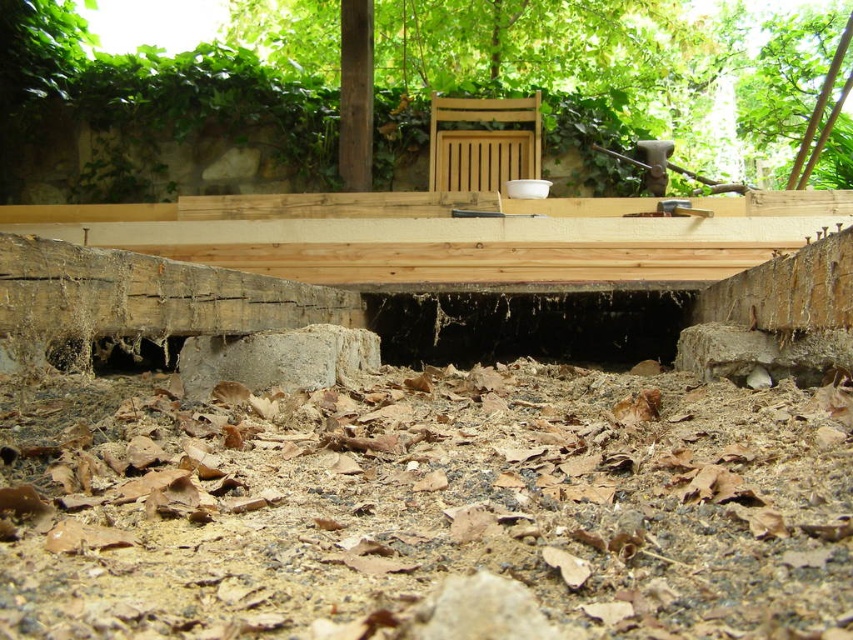
You are a contractor assessing the construction site. You need to determine if the brown dirt at center is level with the natural wood deck at center. Based on the scene, what can you conclude?

The brown dirt at center is shorter than the natural wood deck at center, so they are not level.

You are a construction worker who needs to move a 5 foot long tool from the brown dirt at center to the natural wood deck at center. Can you move the tool without bending or lifting it too high?

The brown dirt at center is 4.94 feet away from the natural wood deck at center. Since the tool is 5 feet long, it is slightly longer than the distance between them. Therefore, you cannot move the tool without bending or lifting it too high to avoid it dragging or getting stuck.

You are a contractor assessing the construction site. You need to determine the spatial relationship between the natural wood deck at center and the wooden chair at center. Which object is positioned lower in the scene?

The natural wood deck at center is located below the wooden chair at center, so the natural wood deck at center is positioned lower in the scene.